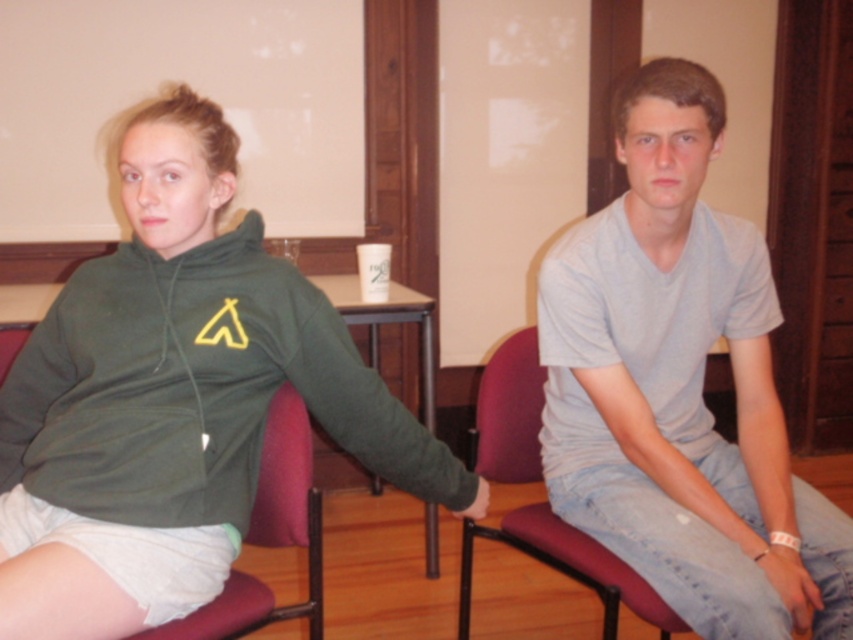
How distant is gray cotton t-shirt at center from velvet-like fabric armchair at center-left?

A distance of 21.72 inches exists between gray cotton t-shirt at center and velvet-like fabric armchair at center-left.

Which is behind, point (604, 337) or point (276, 474)?

The point (276, 474) is behind.

Is point (640, 122) more distant than point (315, 586)?

No, it is in front of (315, 586).

Identify the location of gray cotton t-shirt at center. Image resolution: width=853 pixels, height=640 pixels. (680, 387).

Who is more forward, (236, 304) or (740, 632)?

Point (740, 632) is more forward.

Does green matte hoodie at left come behind gray cotton t-shirt at center?

No.

Image resolution: width=853 pixels, height=640 pixels. Describe the element at coordinates (175, 400) in the screenshot. I see `green matte hoodie at left` at that location.

Find the location of a particular element. This screenshot has width=853, height=640. green matte hoodie at left is located at coordinates (175, 400).

Is gray cotton t-shirt at center smaller than matte plastic chair at center?

Incorrect, gray cotton t-shirt at center is not smaller in size than matte plastic chair at center.

Who is higher up, gray cotton t-shirt at center or matte plastic chair at center?

Positioned higher is gray cotton t-shirt at center.

Which is in front, point (704, 557) or point (579, 572)?

Point (704, 557)

This screenshot has height=640, width=853. Find the location of `gray cotton t-shirt at center`. gray cotton t-shirt at center is located at coordinates (680, 387).